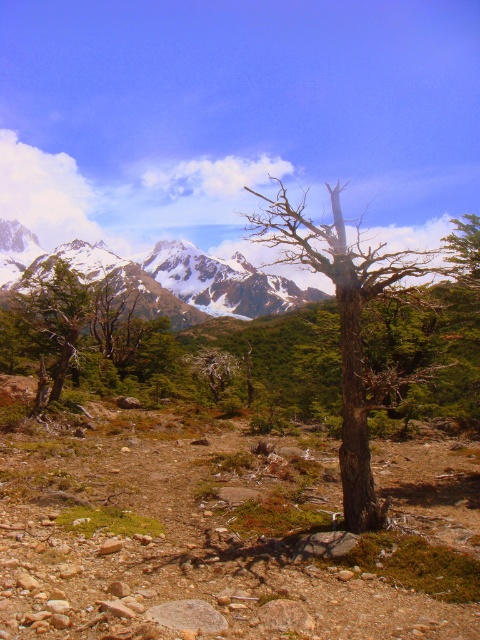
You are an environmental scientist assessing the health of trees in this mountainous area. You observe the brown rough tree at center and the green matte tree at left. Which tree would you prioritize for further study based on their size and the scene context?

The brown rough tree at center has a larger size compared to the green matte tree at left. Given the barren and rugged environment described in the scene, the larger size of the brown rough tree at center may indicate either resilience or potential distress, making it a priority for study to understand its adaptation mechanisms or health concerns.

You are standing at the point marked as point [343,323] in the rugged mountain landscape. What type of tree are you touching?

The point [343,323] is on the brown rough tree at center, so you are touching the brown rough tree at center.